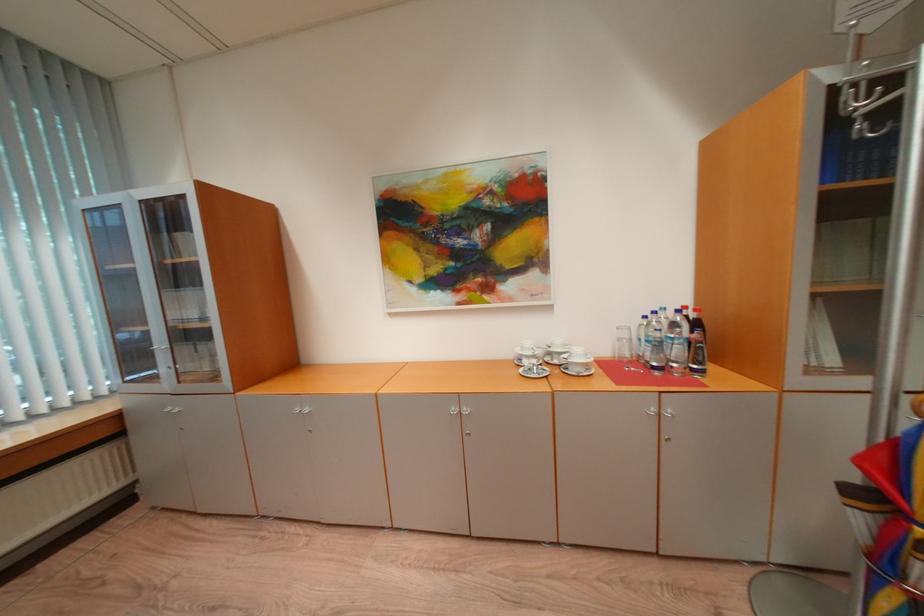
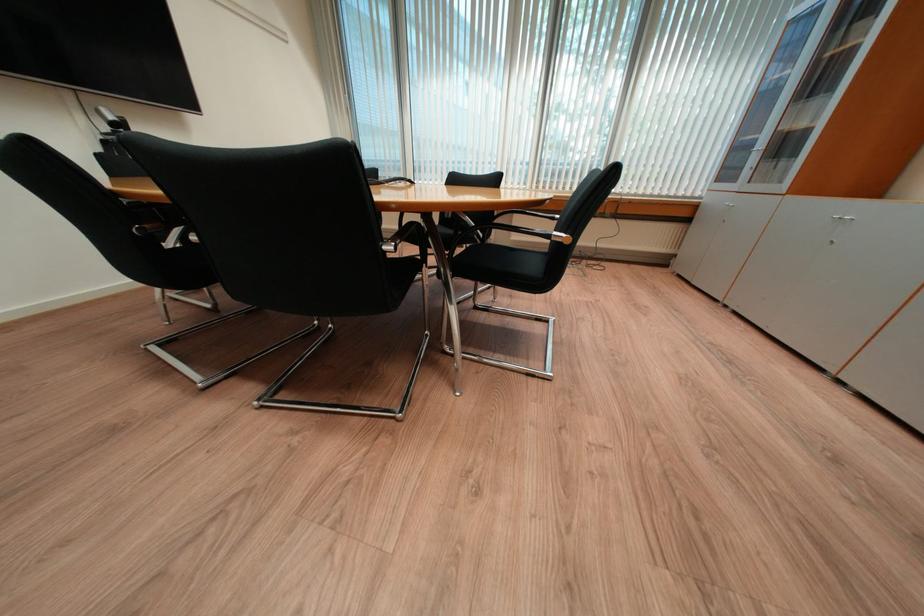
The first image is from the beginning of the video and the second image is from the end. How did the camera likely rotate when shooting the video?

The camera's rotation is toward left-down.